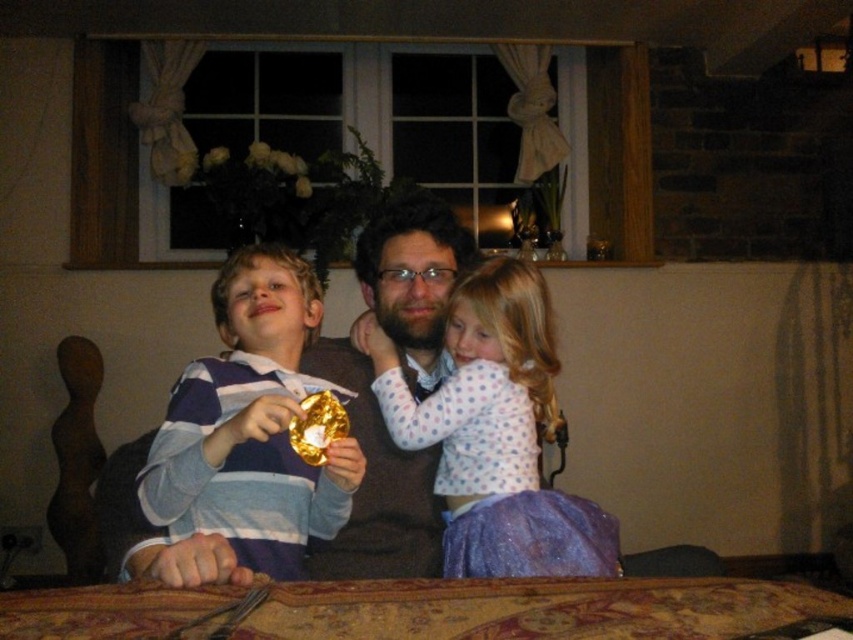
You are standing in the living room and want to place a 24 inch wide board on the wooden table at center. Can you fit it on the table?

The wooden table at center is 26.01 inches from viewer, so the 24 inch wide board can be placed on it as it is narrower than the table.

You are a photographer setting up for a family photo. You have a wooden table at center and a purple glitter dress at center in the scene. Where should you place your camera to ensure both objects are in the frame?

You should position your camera so that it captures both the wooden table at center and the purple glitter dress at center, as the wooden table at center is positioned under the purple glitter dress at center, meaning they are aligned vertically. This allows both to be visible in the same frame when viewed from an angle that accommodates their vertical arrangement.